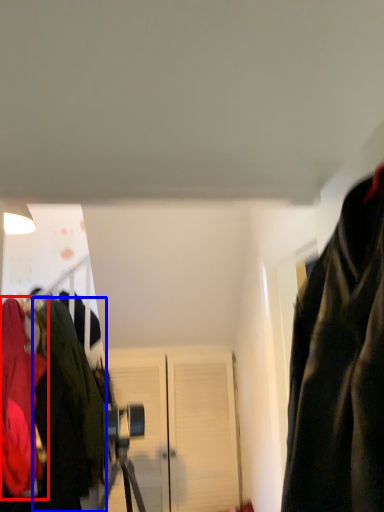
Question: Which object is further to the camera taking this photo, jacket (highlighted by a red box) or jacket (highlighted by a blue box)?

Choices:
 (A) jacket
 (B) jacket

Answer: (B)